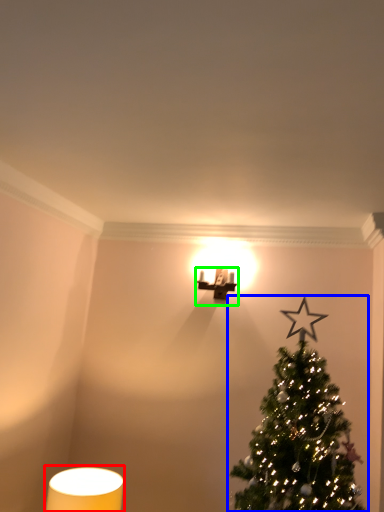
Question: Which object is the farthest from table lamp (highlighted by a red box)? Choose among these: christmas tree (highlighted by a blue box) or table lamp (highlighted by a green box).

Choices:
 (A) christmas tree
 (B) table lamp

Answer: (B)